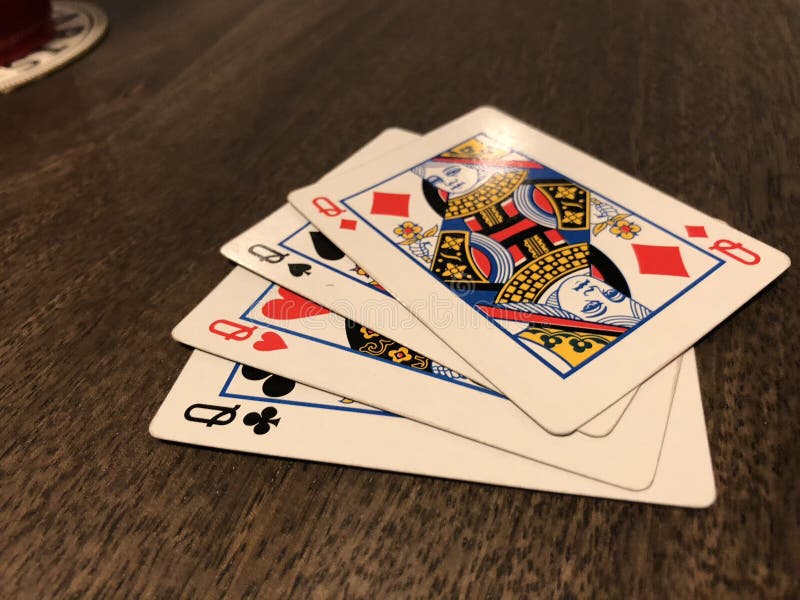
The width and height of the screenshot is (800, 600). Find the location of `wooden table top`. wooden table top is located at coordinates (90, 290), (248, 122), (598, 77), (768, 443), (326, 540).